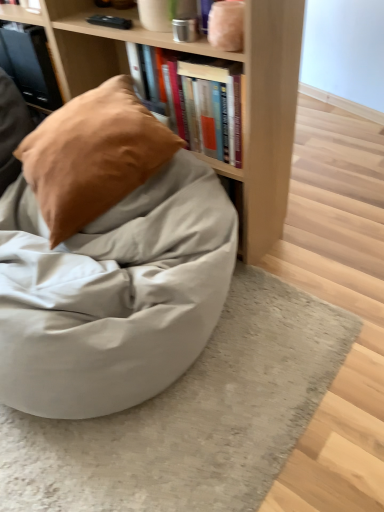
Image resolution: width=384 pixels, height=512 pixels. I want to click on hardcover books at upper center, which ranks as the second book in left-to-right order, so [x=214, y=106].

This screenshot has width=384, height=512. What do you see at coordinates (108, 259) in the screenshot?
I see `matte gray bean bag at center` at bounding box center [108, 259].

Locate an element on the screen. matte black book at upper left, which is the first book from left to right is located at coordinates (29, 63).

From the image's perspective, does matte black book at upper left, which is the 1th book in back-to-front order, appear higher than light wood bookcase at upper center?

Yes, from the image's perspective, matte black book at upper left, which is the 1th book in back-to-front order, is above light wood bookcase at upper center.

From a real-world perspective, relative to light wood bookcase at upper center, is matte black book at upper left, which is the first book from left to right, vertically above or below?

matte black book at upper left, which is the first book from left to right, is above light wood bookcase at upper center.

Is matte black book at upper left, the first book in the top-to-bottom sequence, at the right side of light wood bookcase at upper center?

No.

How different are the orientations of suede-like tan pillow at upper left and matte black book at upper left, the first book in the top-to-bottom sequence, in degrees?

The angular difference between suede-like tan pillow at upper left and matte black book at upper left, the first book in the top-to-bottom sequence, is 26.4 degrees.

Is suede-like tan pillow at upper left oriented towards matte black book at upper left, the first book in the top-to-bottom sequence?

No, suede-like tan pillow at upper left is not aimed at matte black book at upper left, the first book in the top-to-bottom sequence.

Considering their positions, is suede-like tan pillow at upper left located in front of or behind matte black book at upper left, which is the 2th book in front-to-back order?

Visually, suede-like tan pillow at upper left is located in front of matte black book at upper left, which is the 2th book in front-to-back order.

Is suede-like tan pillow at upper left shorter than matte black book at upper left, which ranks as the second book in bottom-to-top order?

Indeed, suede-like tan pillow at upper left has a lesser height compared to matte black book at upper left, which ranks as the second book in bottom-to-top order.

Is suede-like tan pillow at upper left next to light wood bookcase at upper center?

No, suede-like tan pillow at upper left is not with light wood bookcase at upper center.

Between point (80, 194) and point (273, 152), which one is positioned in front?

Point (80, 194)

Is matte black book at upper left, the first book in the top-to-bottom sequence, far away from matte gray bean bag at center?

No, matte black book at upper left, the first book in the top-to-bottom sequence, is not far from matte gray bean bag at center.

Which is in front, point (42, 102) or point (99, 106)?

Point (99, 106)

Is matte black book at upper left, which is the 1th book in back-to-front order, positioned with its back to matte gray bean bag at center?

matte black book at upper left, which is the 1th book in back-to-front order, does not have its back to matte gray bean bag at center.

Considering the sizes of objects matte black book at upper left, which is the second book in right-to-left order, and matte gray bean bag at center in the image provided, who is thinner, matte black book at upper left, which is the second book in right-to-left order, or matte gray bean bag at center?

matte black book at upper left, which is the second book in right-to-left order.

Is light wood bookcase at upper center smaller than hardcover books at upper center, which is the first book in bottom-to-top order?

No.

Considering the points (218, 173) and (203, 138), which point is behind, point (218, 173) or point (203, 138)?

The point (203, 138) is behind.

Which object is further away from the camera taking this photo, light wood bookcase at upper center or hardcover books at upper center, arranged as the 2th book when viewed from the top?

hardcover books at upper center, arranged as the 2th book when viewed from the top, is further away from the camera.

Could you tell me if light wood bookcase at upper center is turned towards hardcover books at upper center, the 1th book viewed from the right?

No, light wood bookcase at upper center is not facing towards hardcover books at upper center, the 1th book viewed from the right.

Which object is positioned more to the left, light wood bookcase at upper center or matte black book at upper left, which is the first book from left to right?

matte black book at upper left, which is the first book from left to right.

Which point is more distant from viewer, (x=267, y=178) or (x=6, y=48)?

The point (x=6, y=48) is behind.

Can you tell me how much light wood bookcase at upper center and matte black book at upper left, which is the 1th book in back-to-front order, differ in facing direction?

The angle between the facing direction of light wood bookcase at upper center and the facing direction of matte black book at upper left, which is the 1th book in back-to-front order, is 88.4 degrees.

Based on the photo, is light wood bookcase at upper center looking in the opposite direction of matte black book at upper left, which is the 2th book in front-to-back order?

No, light wood bookcase at upper center is not facing away from matte black book at upper left, which is the 2th book in front-to-back order.

Locate an element on the screen. This screenshot has width=384, height=512. bean bag chair that is under the suede-like tan pillow at upper left (from a real-world perspective) is located at coordinates (108, 259).

Are matte gray bean bag at center and suede-like tan pillow at upper left far apart?

No, matte gray bean bag at center is not far away from suede-like tan pillow at upper left.

Identify the location of bookcase located below the matte black book at upper left, which is the first book from left to right (from the image's perspective). (209, 56).

The image size is (384, 512). What are the coordinates of `the 2nd book above the suede-like tan pillow at upper left (from the image's perspective)` in the screenshot? It's located at (29, 63).

Which object lies further to the anchor point matte gray bean bag at center, hardcover books at upper center, the 1th book viewed from the right, or matte black book at upper left, which is the first book from left to right?

Based on the image, matte black book at upper left, which is the first book from left to right, appears to be further to matte gray bean bag at center.

Which object lies further to the anchor point hardcover books at upper center, which is the first book in bottom-to-top order, suede-like tan pillow at upper left or matte gray bean bag at center?

matte gray bean bag at center is positioned further to the anchor hardcover books at upper center, which is the first book in bottom-to-top order.

When comparing their distances from light wood bookcase at upper center, does matte gray bean bag at center or hardcover books at upper center, arranged as the 2th book when viewed from the back, seem further?

matte gray bean bag at center lies further to light wood bookcase at upper center than the other object.

Based on their spatial positions, is matte black book at upper left, which is the first book from left to right, or light wood bookcase at upper center further from suede-like tan pillow at upper left?

The object further to suede-like tan pillow at upper left is matte black book at upper left, which is the first book from left to right.

Considering their positions, is suede-like tan pillow at upper left positioned further to hardcover books at upper center, arranged as the 2th book when viewed from the top, than matte black book at upper left, which is the first book from left to right?

→ Among the two, matte black book at upper left, which is the first book from left to right, is located further to hardcover books at upper center, arranged as the 2th book when viewed from the top.

From the picture: From the image, which object appears to be nearer to matte black book at upper left, which is the 2th book in front-to-back order, suede-like tan pillow at upper left or hardcover books at upper center, arranged as the 2th book when viewed from the top?

suede-like tan pillow at upper left.

When comparing their distances from light wood bookcase at upper center, does hardcover books at upper center, the first book in the front-to-back sequence, or suede-like tan pillow at upper left seem closer?

The object closer to light wood bookcase at upper center is hardcover books at upper center, the first book in the front-to-back sequence.

When comparing their distances from matte gray bean bag at center, does matte black book at upper left, which is the first book from left to right, or hardcover books at upper center, the 1th book viewed from the right, seem further?

matte black book at upper left, which is the first book from left to right, is positioned further to the anchor matte gray bean bag at center.

Locate an element on the screen. This screenshot has width=384, height=512. bookcase positioned between matte gray bean bag at center and matte black book at upper left, which is the 1th book in back-to-front order, from near to far is located at coordinates (209, 56).

Locate an element on the screen. The width and height of the screenshot is (384, 512). pillow between light wood bookcase at upper center and hardcover books at upper center, which is the first book in bottom-to-top order is located at coordinates (93, 155).

Locate an element on the screen. This screenshot has height=512, width=384. pillow between matte gray bean bag at center and hardcover books at upper center, the first book in the front-to-back sequence, from left to right is located at coordinates (93, 155).

The width and height of the screenshot is (384, 512). What are the coordinates of `bookcase between matte black book at upper left, which is the first book from left to right, and hardcover books at upper center, the 1th book viewed from the right` in the screenshot? It's located at (209, 56).